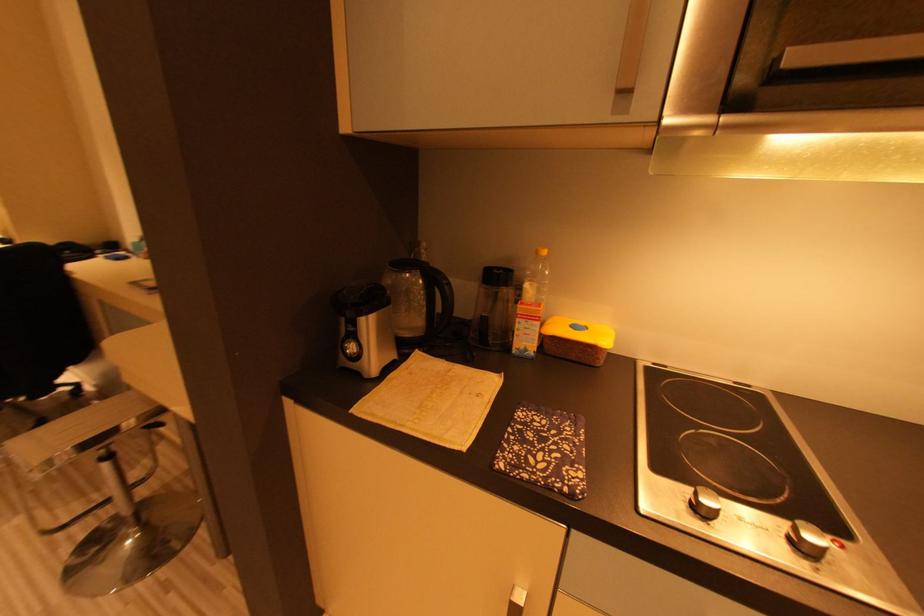
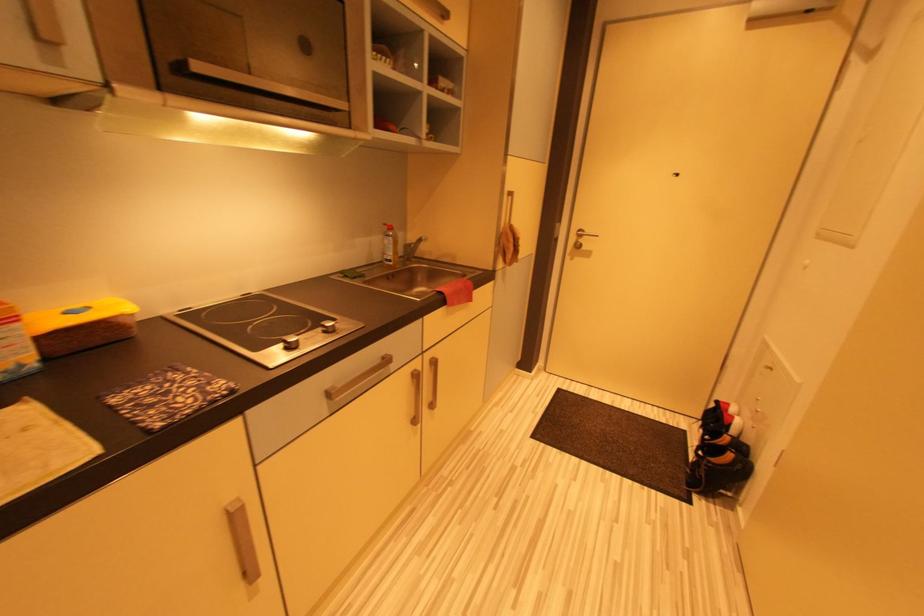
How did the camera likely rotate?

The camera's rotation is toward right-down.